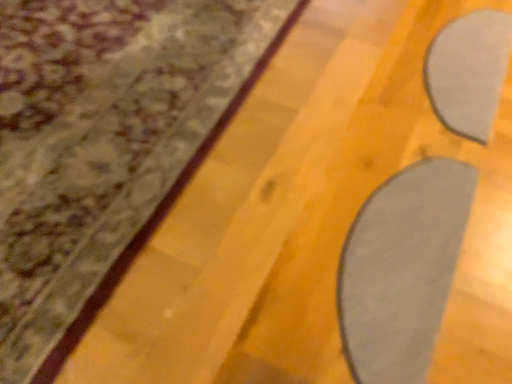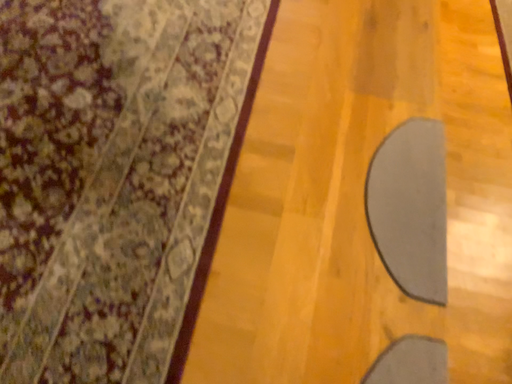
Question: Which way did the camera rotate in the video?

Choices:
 (A) rotated left
 (B) rotated right

Answer: (B)